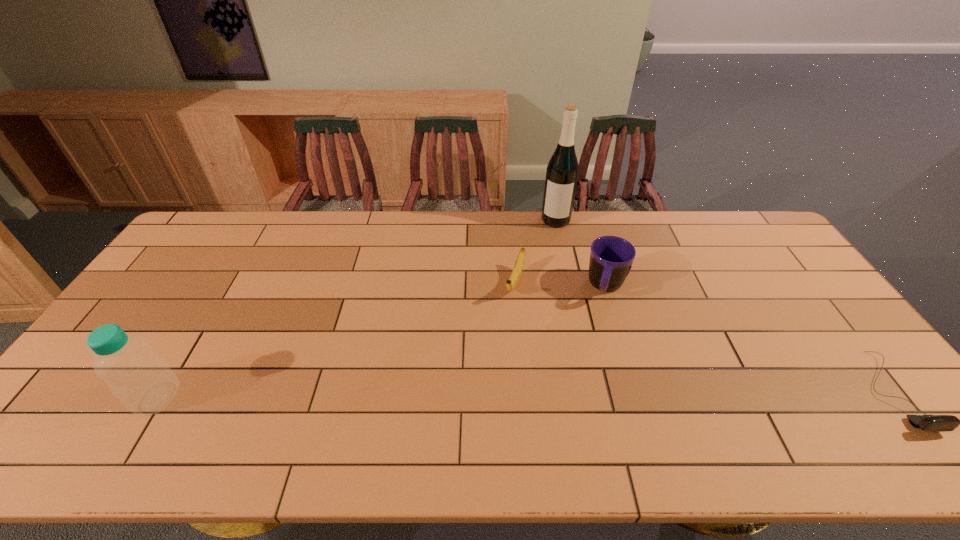
Where is `bottle that is at the near edge`? bottle that is at the near edge is located at coordinates (140, 379).

Where is `webcam situated at the near edge`? Image resolution: width=960 pixels, height=540 pixels. webcam situated at the near edge is located at coordinates (935, 423).

Identify the location of object situated at the right edge. This screenshot has width=960, height=540. (935, 423).

Identify the location of object that is at the near right corner. (935, 423).

At what (x,y) coordinates should I click in order to perform the action: click on free space at the far edge of the desktop. Please return your answer as a coordinate pair (x, y). The image size is (960, 540). Looking at the image, I should click on (514, 224).

Locate an element on the screen. This screenshot has width=960, height=540. vacant space at the near edge of the desktop is located at coordinates (391, 397).

The image size is (960, 540). Identify the location of vacant space at the left edge. (187, 256).

This screenshot has height=540, width=960. Identify the location of vacant region at the right edge of the desktop. click(x=787, y=294).

What are the coordinates of `free space at the near right corner` in the screenshot? It's located at (885, 392).

At what (x,y) coordinates should I click in order to perform the action: click on unoccupied position between the third tallest object and the farthest object. Please return your answer as a coordinate pair (x, y). Image resolution: width=960 pixels, height=540 pixels. Looking at the image, I should click on (581, 253).